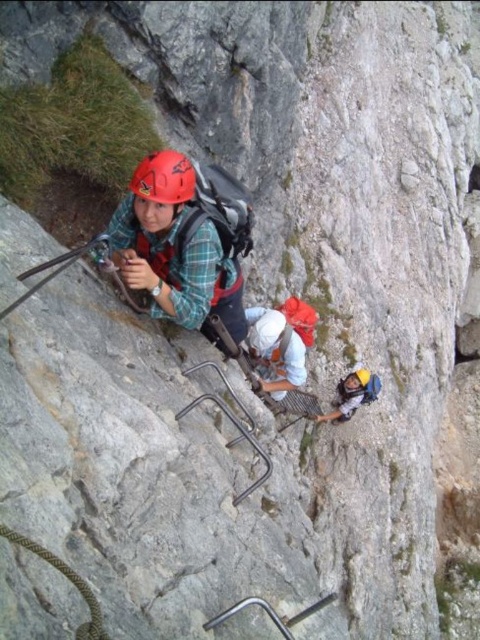
Question: Estimate the real-world distances between objects in this image. Which object is farther from the matte red helmet at upper left?

Choices:
 (A) matte black helmet at upper center
 (B) brown textured rope at lower left
 (C) matte yellow helmet at lower center
 (D) white fabric helmet at center

Answer: (C)

Question: Is white fabric helmet at center thinner than brown textured rope at lower left?

Choices:
 (A) no
 (B) yes

Answer: (A)

Question: Can you confirm if brown textured rope at lower left is positioned to the left of matte yellow helmet at lower center?

Choices:
 (A) no
 (B) yes

Answer: (B)

Question: Is white fabric helmet at center positioned in front of brown textured rope at lower left?

Choices:
 (A) yes
 (B) no

Answer: (B)

Question: Which object is positioned closest to the matte black helmet at upper center?

Choices:
 (A) brown textured rope at lower left
 (B) matte yellow helmet at lower center
 (C) white fabric helmet at center
 (D) matte red helmet at upper left

Answer: (D)

Question: Based on their relative distances, which object is nearer to the matte black helmet at upper center?

Choices:
 (A) matte red helmet at upper left
 (B) matte yellow helmet at lower center
 (C) white fabric helmet at center

Answer: (A)